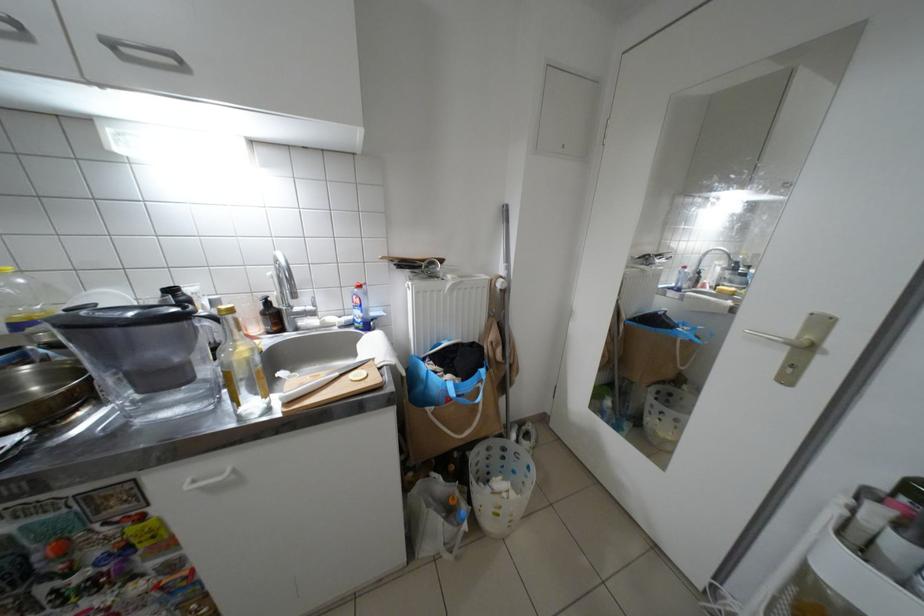
Where is `gold door handle`? The image size is (924, 616). gold door handle is located at coordinates (784, 339).